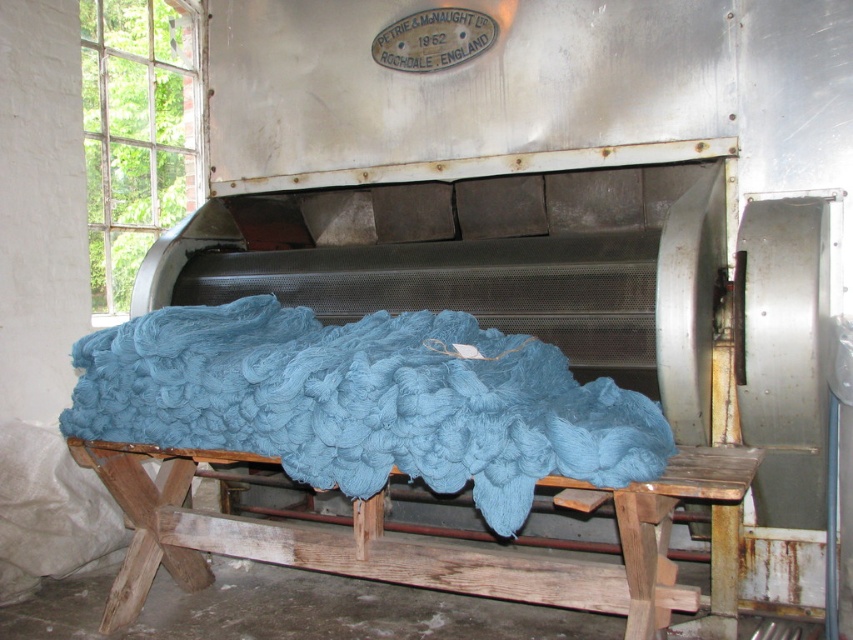
You are an interior designer planning to place the teal woolen blanket at center and the wooden stool at center in a cozy living room. Which object should you place first if you want the smaller item closer to the sofa?

The teal woolen blanket at center is smaller than the wooden stool at center, so you should place the teal woolen blanket at center first to ensure it is closer to the sofa.

You are standing in the middle of the industrial facility and see the teal woolen blanket at center and the wooden stool at center. Which object is closer to the entrance of the facility?

The teal woolen blanket at center is to the left of the wooden stool at center, but the description does not provide information about their proximity to the entrance of the facility. Therefore, it is impossible to determine which object is closer to the entrance based on the given information.